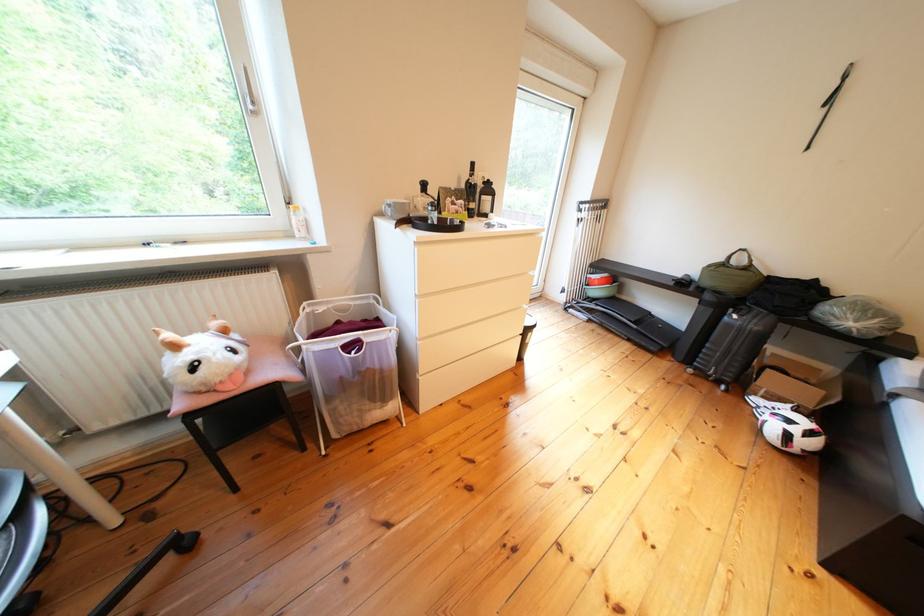
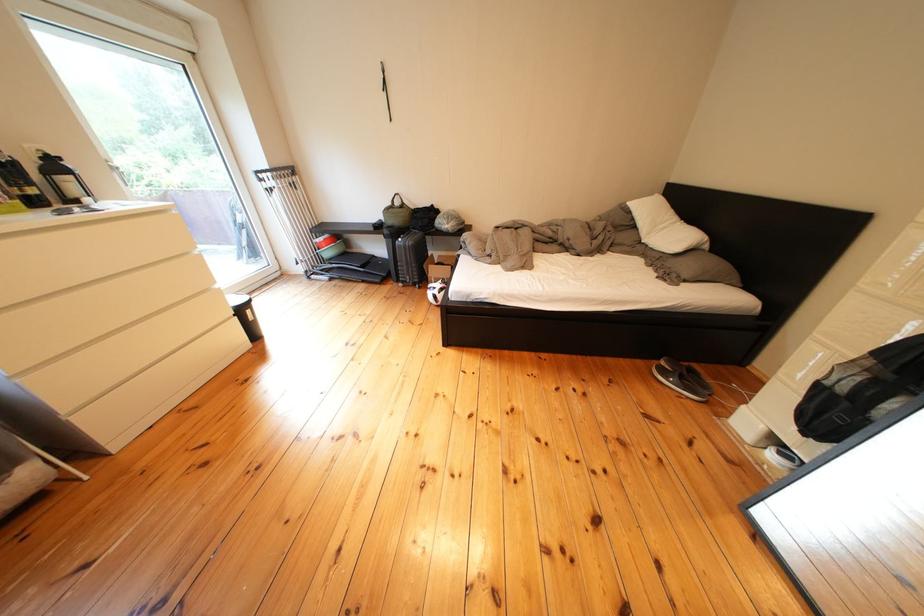
In the second image, find the point that corresponds to (723,301) in the first image.

(399, 236)